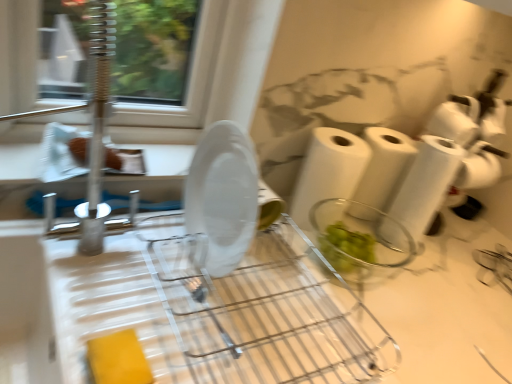
Question: Does white paper towel at center, placed as the first paper towel when sorted from left to right, have a greater width compared to white paper towel at right, which ranks as the 2th toilet paper in top-to-bottom order?

Choices:
 (A) yes
 (B) no

Answer: (B)

Question: Does white paper towel at center, placed as the first paper towel when sorted from left to right, have a lesser width compared to white paper towel at right, which ranks as the 2th toilet paper in top-to-bottom order?

Choices:
 (A) yes
 (B) no

Answer: (A)

Question: Is white paper towel at center, placed as the first paper towel when sorted from left to right, to the right of white paper towel at right, which ranks as the 2th toilet paper in top-to-bottom order, from the viewer's perspective?

Choices:
 (A) yes
 (B) no

Answer: (B)

Question: Are white paper towel at center, which is the 2th paper towel in right-to-left order, and white paper towel at right, which ranks as the 2th toilet paper in top-to-bottom order, located far from each other?

Choices:
 (A) yes
 (B) no

Answer: (B)

Question: Is white paper towel at center, placed as the first paper towel when sorted from left to right, facing towards white paper towel at right, which ranks as the 2th toilet paper in top-to-bottom order?

Choices:
 (A) yes
 (B) no

Answer: (B)

Question: Is white paper towel at right, which ranks as the 2th toilet paper in top-to-bottom order, at the back of white paper towel at center, placed as the first paper towel when sorted from left to right?

Choices:
 (A) yes
 (B) no

Answer: (B)

Question: Is transparent plastic plate at center further to camera compared to white matte toilet paper at upper right, the fourth toilet paper ordered from the bottom?

Choices:
 (A) no
 (B) yes

Answer: (A)

Question: Does transparent plastic plate at center have a larger size compared to white matte toilet paper at upper right, the fourth toilet paper ordered from the bottom?

Choices:
 (A) no
 (B) yes

Answer: (B)

Question: Is transparent plastic plate at center oriented towards white matte toilet paper at upper right, the fourth toilet paper ordered from the bottom?

Choices:
 (A) no
 (B) yes

Answer: (A)

Question: Would you say transparent plastic plate at center is outside white matte toilet paper at upper right, the fourth toilet paper ordered from the bottom?

Choices:
 (A) yes
 (B) no

Answer: (A)

Question: From a real-world perspective, is transparent plastic plate at center on white matte toilet paper at upper right, the first toilet paper when ordered from top to bottom?

Choices:
 (A) no
 (B) yes

Answer: (A)

Question: Can you confirm if transparent plastic plate at center is positioned to the left of white matte toilet paper at upper right, the first toilet paper when ordered from top to bottom?

Choices:
 (A) no
 (B) yes

Answer: (B)

Question: Is white matte toilet paper at upper right, the fourth toilet paper ordered from the bottom, closer to camera compared to white paper towel at center, which is counted as the 1th paper towel, starting from the right?

Choices:
 (A) yes
 (B) no

Answer: (A)